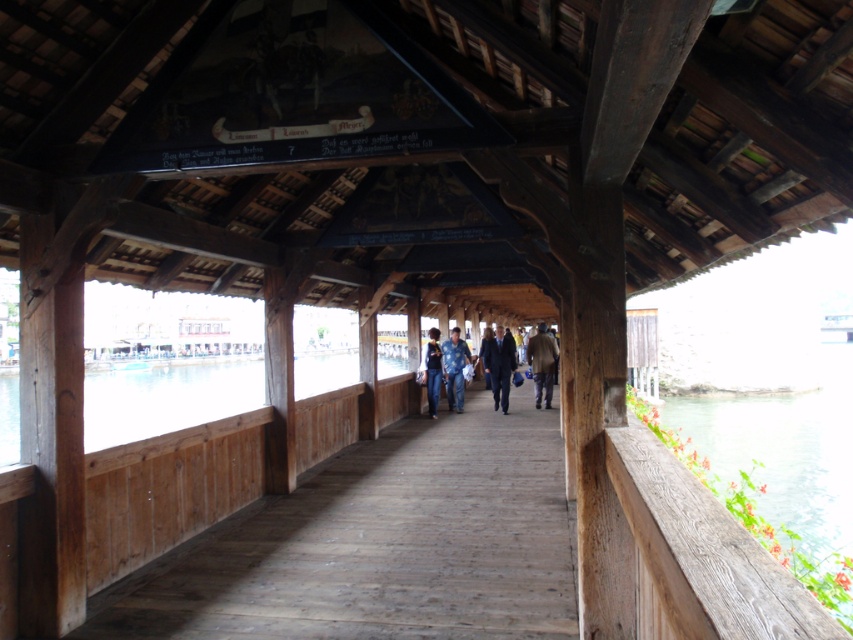
You are standing on the wooden planks of the bridge and see both the transparent glass water at center and the dark blue suit at center. Which object is taller?

The transparent glass water at center is taller than the dark blue suit at center.

You are a painter who wants to place a 1.5 meter wide canvas on the bridge. The canvas is as wide as the brown leather jacket at center. Will the green wooden railing at right be able to support the canvas if placed next to it?

The green wooden railing at right has a larger width than the brown leather jacket at center. Since the canvas is as wide as the jacket, the railing can support it as it is wider and more stable.

You are a tourist standing on the wooden planks of the bridge and see the transparent glass water at center and the dark blue suit at center. Which object is bigger in size?

The transparent glass water at center has a larger size compared to the dark blue suit at center.